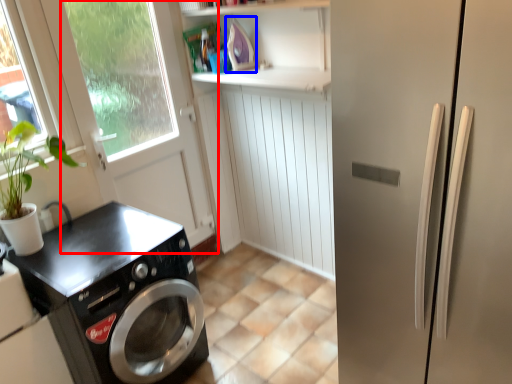
Question: Among these objects, which one is nearest to the camera, screen door (highlighted by a red box) or appliance (highlighted by a blue box)?

Choices:
 (A) screen door
 (B) appliance

Answer: (A)